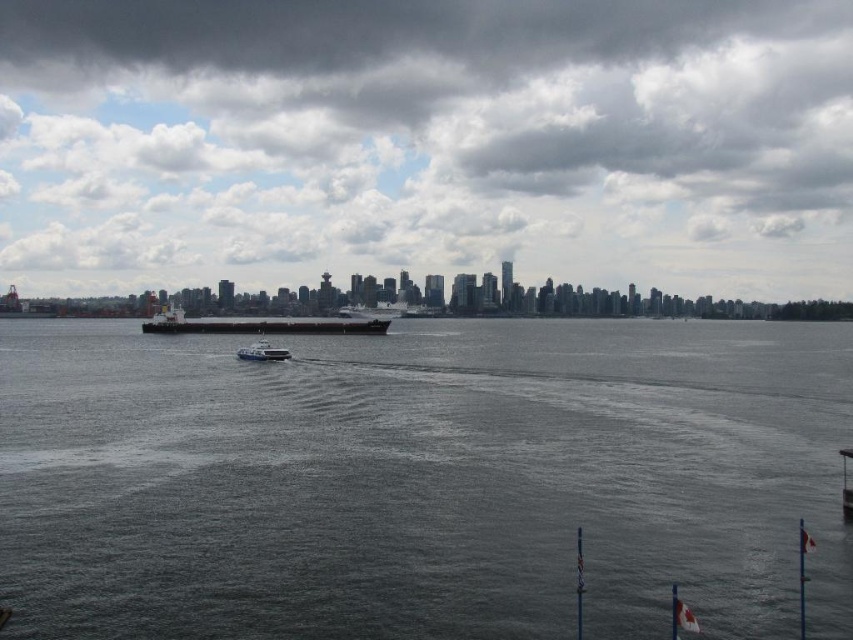
Which of these two, cloudy sky at upper center or matte black ship at center, stands shorter?

With less height is matte black ship at center.

Can you confirm if cloudy sky at upper center is wider than matte black ship at center?

Yes.

Is point (343, 72) more distant than point (375, 332)?

Yes, it is.

Where is `cloudy sky at upper center`? This screenshot has height=640, width=853. cloudy sky at upper center is located at coordinates pyautogui.click(x=427, y=141).

Is dark gray water at center to the right of cloudy sky at upper center from the viewer's perspective?

Yes, dark gray water at center is to the right of cloudy sky at upper center.

At what (x,y) coordinates should I click in order to perform the action: click on dark gray water at center. Please return your answer as a coordinate pair (x, y). Looking at the image, I should click on (422, 481).

Find the location of a particular element. dark gray water at center is located at coordinates (422, 481).

Is matte black ship at center shorter than white plastic boat at center?

In fact, matte black ship at center may be taller than white plastic boat at center.

Describe the element at coordinates (265, 324) in the screenshot. This screenshot has height=640, width=853. I see `matte black ship at center` at that location.

I want to click on matte black ship at center, so click(x=265, y=324).